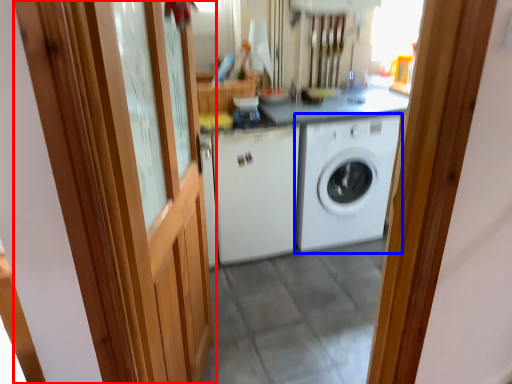
Question: Which of the following is the farthest to the observer, barn door (highlighted by a red box) or washing machine (highlighted by a blue box)?

Choices:
 (A) barn door
 (B) washing machine

Answer: (B)